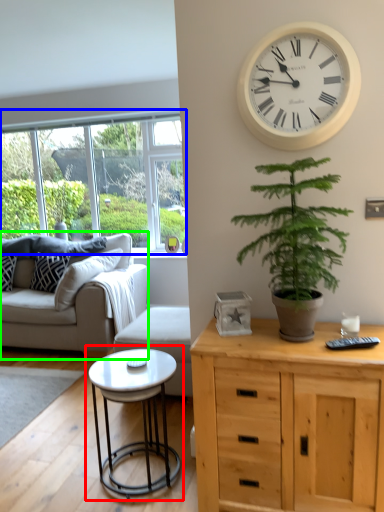
Question: Which object is the farthest from coffee table (highlighted by a red box)? Choose among these: window (highlighted by a blue box) or studio couch (highlighted by a green box).

Choices:
 (A) window
 (B) studio couch

Answer: (A)